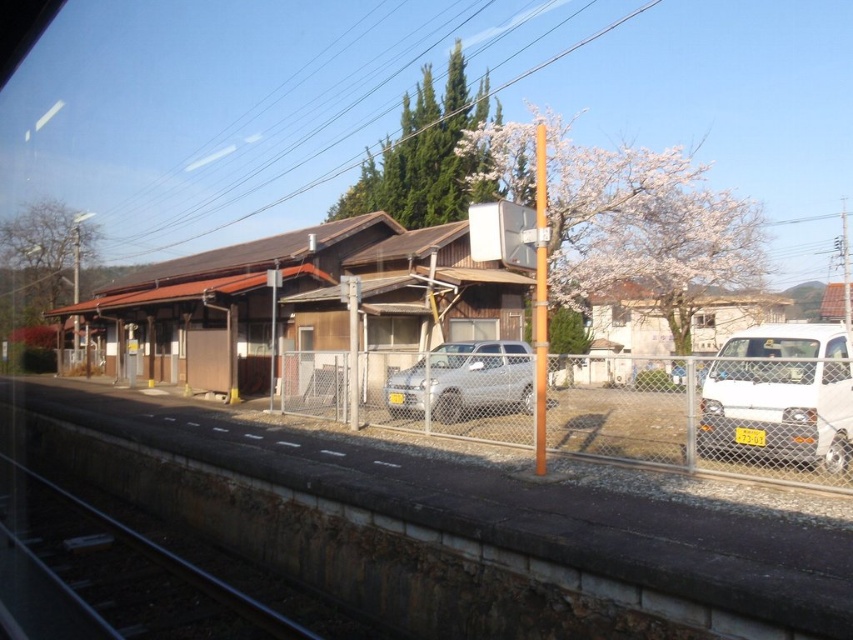
You are standing on the train station platform and want to walk from point A to point B. Point A is located at coordinates point (403, 380) and point B is at point (268, 624). According to the scene description, which direction should you face to move from point A to point B?

Since point (403, 380) is behind point (268, 624), you should face forward towards point B to move from point A to point B.

You are standing on the train platform and want to cross to the other side. You see a satin silver car at center and a black metal train track at lower left. Which object is closer to you, and can you safely step over it to reach the other side?

The satin silver car at center is closer to you than the black metal train track at lower left. However, stepping over a car is not safe, so you should use the designated crossing points instead.